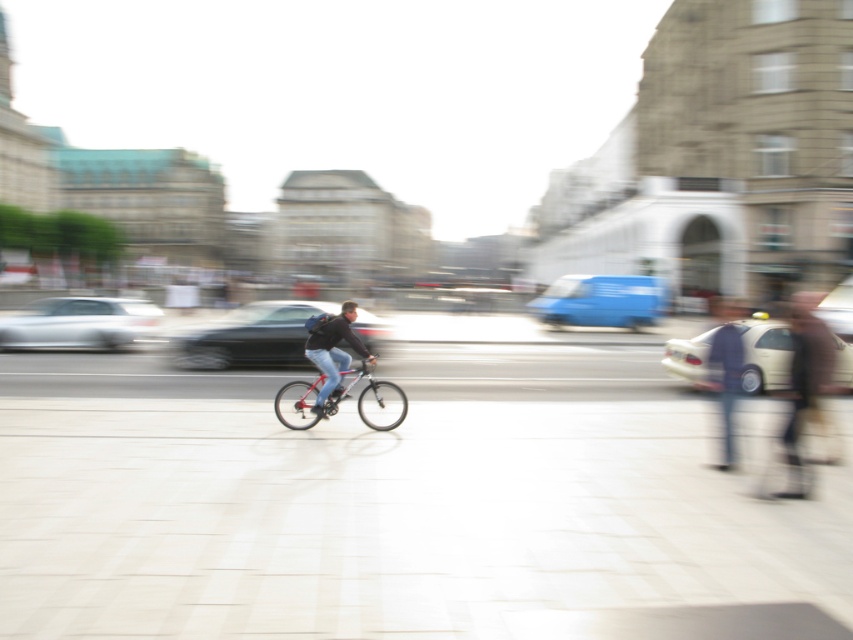
Is black glossy car at center shorter than beige matte taxi at right?

No.

Does point (376, 349) come behind point (670, 356)?

That is True.

Does point (231, 362) come behind point (701, 369)?

Yes, point (231, 362) is behind point (701, 369).

Where is `black glossy car at center`? The height and width of the screenshot is (640, 853). black glossy car at center is located at coordinates (251, 337).

Is black glossy car at center to the right of blurred beige coat at right from the viewer's perspective?

No, black glossy car at center is not to the right of blurred beige coat at right.

Which is behind, point (181, 340) or point (793, 374)?

Point (181, 340)

The width and height of the screenshot is (853, 640). Find the location of `black glossy car at center`. black glossy car at center is located at coordinates (251, 337).

Can you confirm if white tile pavement at center is bigger than dark blue jeans at right?

No, white tile pavement at center is not bigger than dark blue jeans at right.

Is white tile pavement at center above dark blue jeans at right?

Actually, white tile pavement at center is below dark blue jeans at right.

This screenshot has width=853, height=640. What do you see at coordinates (397, 515) in the screenshot?
I see `white tile pavement at center` at bounding box center [397, 515].

Where is `white tile pavement at center`? This screenshot has height=640, width=853. white tile pavement at center is located at coordinates click(397, 515).